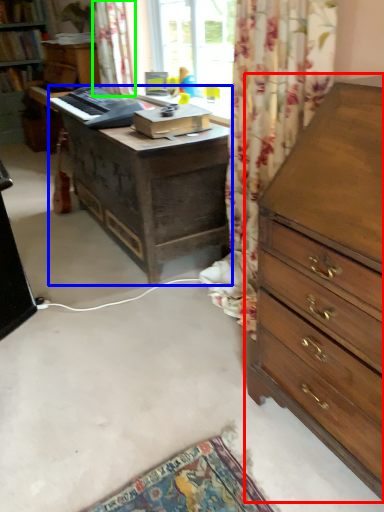
Question: Estimate the real-world distances between objects in this image. Which object is closer to chest of drawers (highlighted by a red box), desk (highlighted by a blue box) or curtain (highlighted by a green box)?

Choices:
 (A) desk
 (B) curtain

Answer: (A)